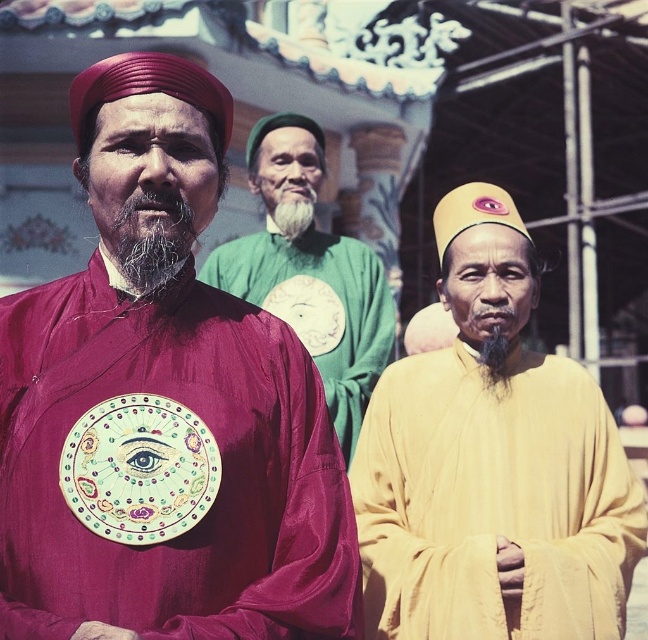
Does green matte robe at center have a greater width compared to gray/woolly beard at center?

Yes, green matte robe at center is wider than gray/woolly beard at center.

Who is shorter, green matte robe at center or gray/woolly beard at center?

With less height is gray/woolly beard at center.

Is point (216, 284) positioned before point (187, 221)?

No, (216, 284) is further to viewer.

Locate an element on the screen. The width and height of the screenshot is (648, 640). green matte robe at center is located at coordinates (318, 308).

Does maroon silk robe at center come behind white soft beard at center?

No, maroon silk robe at center is in front of white soft beard at center.

Can you confirm if maroon silk robe at center is wider than white soft beard at center?

Yes, maroon silk robe at center is wider than white soft beard at center.

What do you see at coordinates (165, 413) in the screenshot? I see `maroon silk robe at center` at bounding box center [165, 413].

What are the coordinates of `maroon silk robe at center` in the screenshot? It's located at (165, 413).

Between maroon silk robe at center and black silky beard at center, which one appears on the right side from the viewer's perspective?

black silky beard at center

Is maroon silk robe at center to the left of black silky beard at center from the viewer's perspective?

Correct, you'll find maroon silk robe at center to the left of black silky beard at center.

Between point (49, 488) and point (500, 355), which one is positioned in front?

Point (49, 488) is in front.

The height and width of the screenshot is (640, 648). Find the location of `maroon silk robe at center`. maroon silk robe at center is located at coordinates (165, 413).